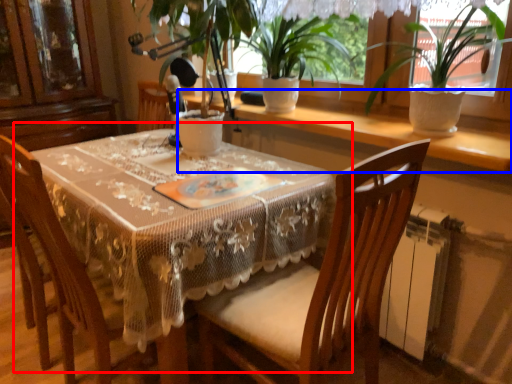
Question: Which of the following is the farthest to the observer, table (highlighted by a red box) or window sill (highlighted by a blue box)?

Choices:
 (A) table
 (B) window sill

Answer: (B)